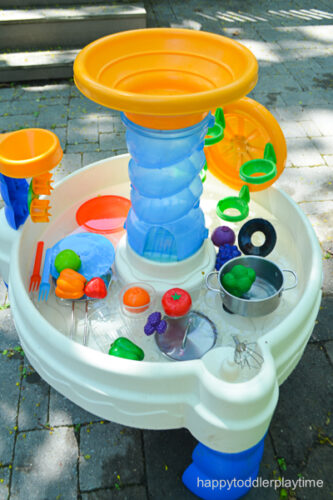
Where is `stairs`? Image resolution: width=333 pixels, height=500 pixels. stairs is located at coordinates (36, 56).